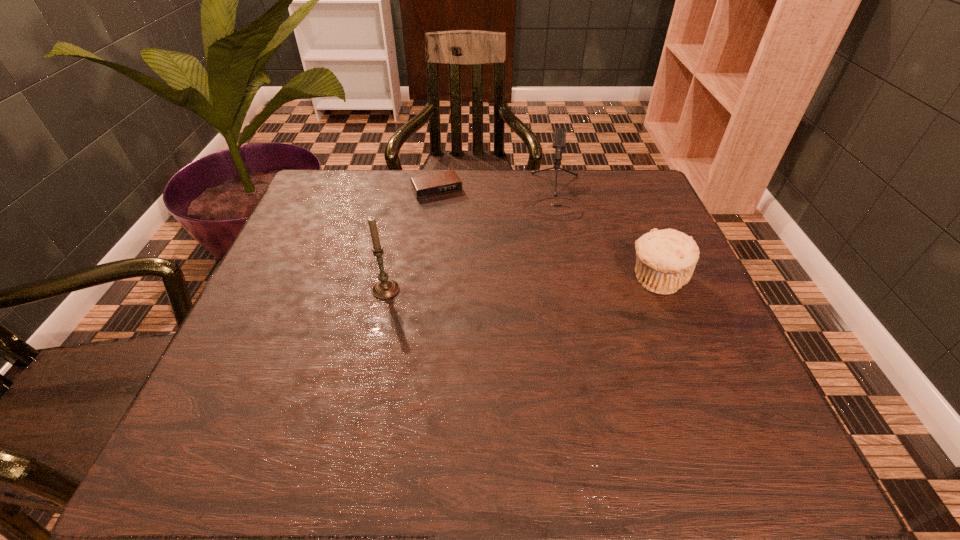
Locate an element on the screen. The height and width of the screenshot is (540, 960). empty space that is in between the tallest object and the third object from left to right is located at coordinates (469, 242).

You are a GUI agent. You are given a task and a screenshot of the screen. Output one action in this format:
    pyautogui.click(x=<x>, y=<y>)
    Task: Click on the vacant area that lies between the alarm clock and the candle
    The image size is (960, 540).
    Given the screenshot: What is the action you would take?
    pyautogui.click(x=411, y=240)

This screenshot has width=960, height=540. Find the location of `object that is the third nearest to the microphone`. object that is the third nearest to the microphone is located at coordinates (386, 288).

Identify the location of object that is the third closest one to the alarm clock. The width and height of the screenshot is (960, 540). pos(666,259).

What are the coordinates of `vacant space that satisfies the following two spatial constraints: 1. on the back side of the microphone; 2. on the left side of the tallest object` in the screenshot? It's located at (406, 195).

Identify the location of free space that satisfies the following two spatial constraints: 1. on the back side of the second object from right to left; 2. on the left side of the candle. This screenshot has width=960, height=540. (406, 195).

Locate an element on the screen. This screenshot has width=960, height=540. vacant position in the image that satisfies the following two spatial constraints: 1. on the front side of the muffin; 2. on the right side of the shortest object is located at coordinates (425, 280).

You are a GUI agent. You are given a task and a screenshot of the screen. Output one action in this format:
    pyautogui.click(x=<x>, y=<y>)
    Task: Click on the blank area in the image that satisfies the following two spatial constraints: 1. on the front side of the rightmost object; 2. on the left side of the shortest object
    This screenshot has width=960, height=540.
    Given the screenshot: What is the action you would take?
    pyautogui.click(x=425, y=280)